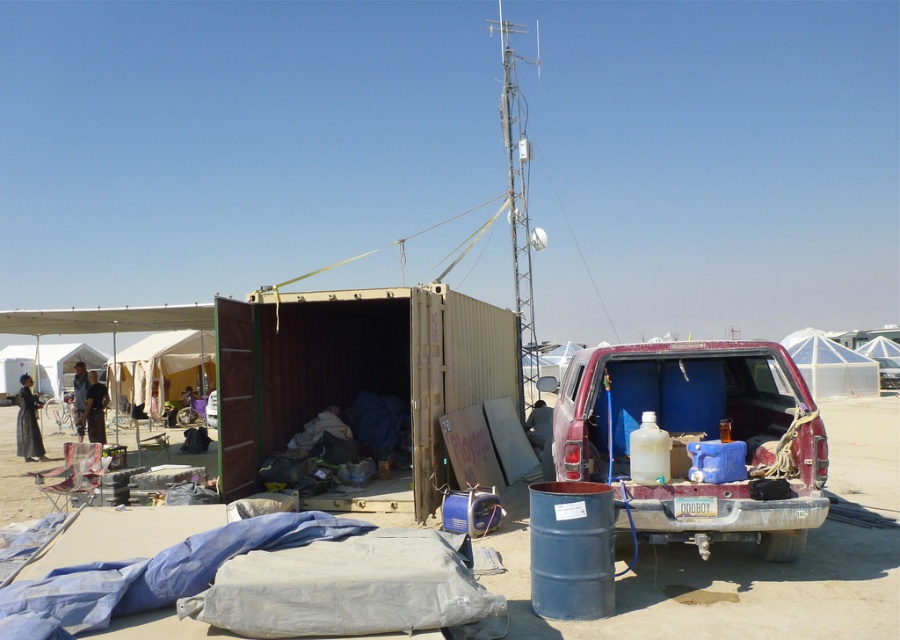
You are planning to set up a new tent in this outdoor area. You want to ensure it won not block the view of the transparent dome at upper right from the white canvas tent at lower left. Based on their positions, is this possible?

The transparent dome at upper right is in front of the white canvas tent at lower left, so setting up a new tent might block the view. To maintain visibility between them, the new tent should be placed behind or to the sides of both existing structures.

You are standing at the origin point of the coordinate system where the bottom left corner of the image is the origin. You want to find the white canvas tent at center. In which direction should you move relative to the origin?

The white canvas tent at center is located at coordinate point 0.577 on the x axis and 0.180 on the y axis. Since the origin is at the bottom left corner, moving towards positive x direction and slightly positive y direction would lead you to the white canvas tent at center.